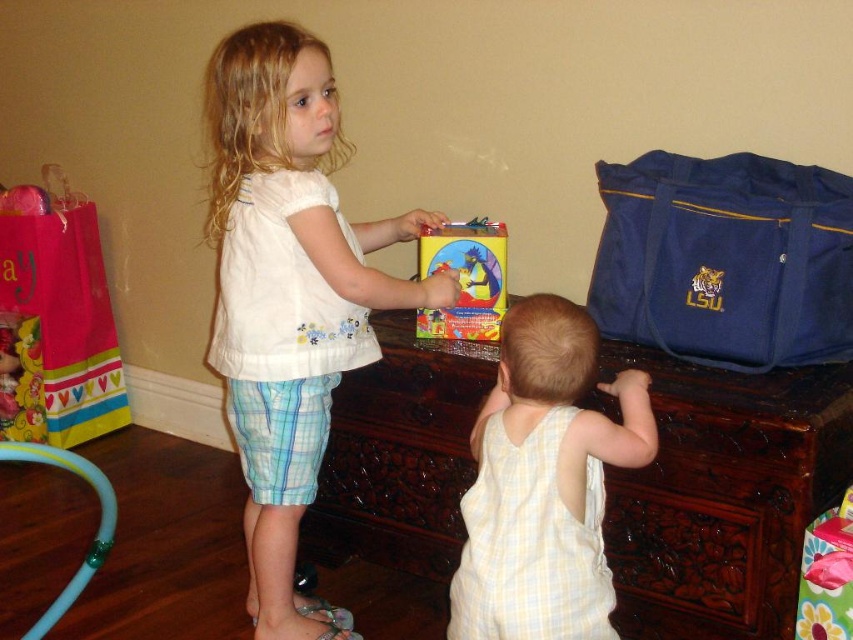
You are a photographer trying to capture a candid shot of both children. You notice two points of interest marked as point [692,417] and point [323,260]. Based on their positions, which point should you focus on first to ensure both children are in frame without moving the camera?

Point [692,417] is in front of point [323,260], so focusing on the closer point first will help keep both children in frame.

You are a parent trying to organize toys. You have a brown carved wood chest at center and a white cotton shirt at center in the room. If you want to place the shirt inside the chest, will it fit based on their sizes?

The brown carved wood chest at center is wider than the white cotton shirt at center, so the shirt should fit inside the chest since the chest is larger in width.

You are a parent standing at the edge of the room and want to hand a toy to the child holding the colorful box. The toy is placed at point (300, 144). Can you reach it without moving from your current position?

The distance between you and point (300, 144) is 1.58 meters. If your reach can extend that far, then yes, you can hand the toy. Otherwise, you might need to move closer.